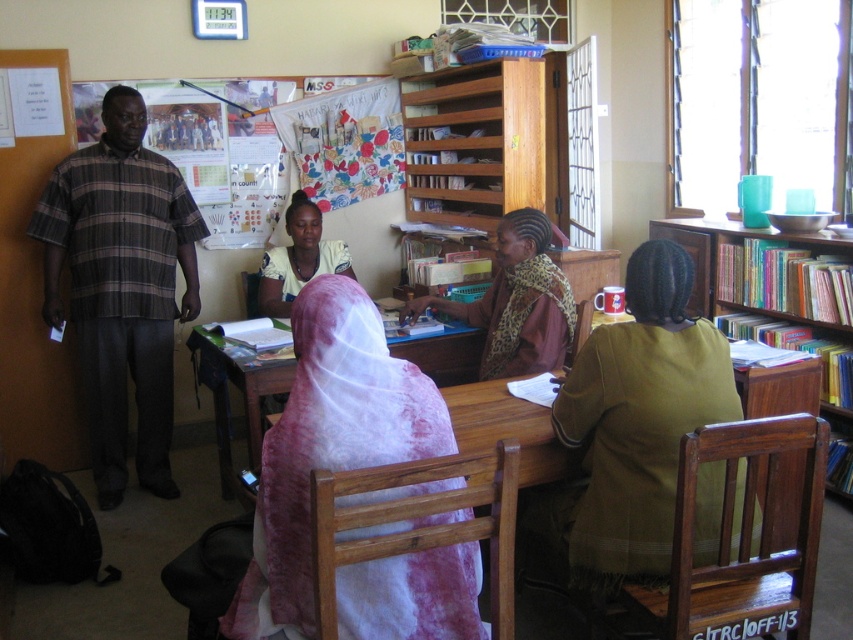
You are organizing a small event in this room and need to decide which item can be used to cover a wider table. Based on the scene, which object is wider between the white sheer fabric at center and the plaid cotton shirt at left?

The plaid cotton shirt at left is wider than the white sheer fabric at center, so the plaid cotton shirt at left can cover a wider table.

You are organizing a clothing donation drive and need to decide which item takes up more space in the donation box. Based on the scene, which item between the plaid cotton shirt at left and the matte white headscarf at center would require more space in the box?

The plaid cotton shirt at left requires more space in the donation box because its width is larger than that of the matte white headscarf at center.

You are organizing a charity event and need to hang a decorative banner between the plaid cotton shirt at left and the green fabric jacket at lower right. Since the banner requires a certain height to be visible, which object should you choose to ensure the banner is tall enough?

The plaid cotton shirt at left has a greater height compared to the green fabric jacket at lower right, so you should hang the banner on the plaid cotton shirt at left to ensure it reaches the necessary height.